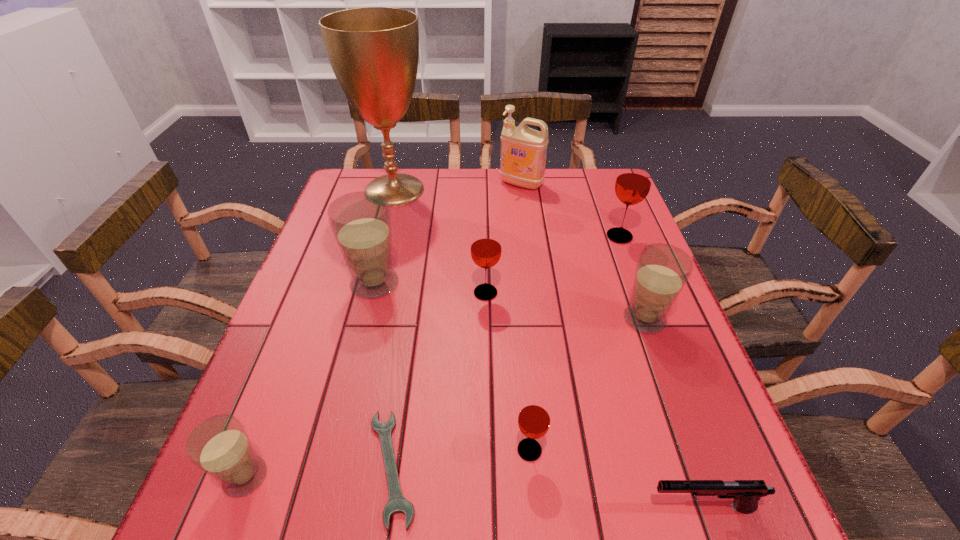
Identify the location of the tallest object. (374, 51).

This screenshot has width=960, height=540. Find the location of `detergent`. detergent is located at coordinates (523, 150).

Identify the location of the third farthest object. (633, 182).

Where is `the farthest red glass`? the farthest red glass is located at coordinates (633, 182).

Find the location of `the biggest blue glass`. the biggest blue glass is located at coordinates (361, 221).

Identify the location of the second glass from left to right. The height and width of the screenshot is (540, 960). (361, 221).

This screenshot has height=540, width=960. In order to click on the second nearest red glass in this screenshot , I will do `click(486, 248)`.

Locate an element on the screen. The height and width of the screenshot is (540, 960). the second smallest red glass is located at coordinates (486, 248).

Identify the location of the second biggest blue glass. This screenshot has height=540, width=960. [662, 270].

Where is `the smallest red glass`? The image size is (960, 540). the smallest red glass is located at coordinates (534, 418).